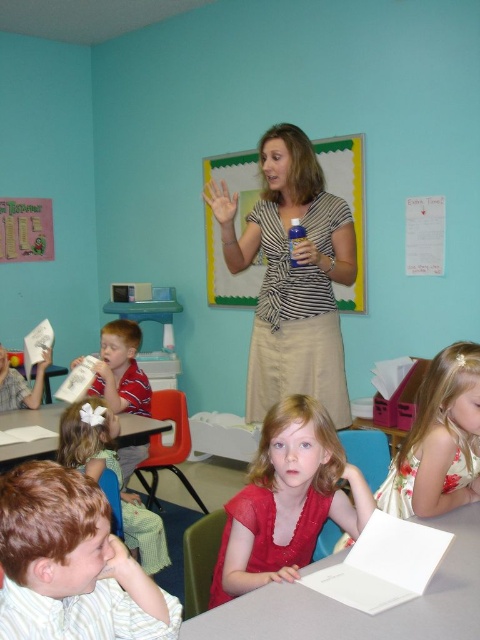
Question: Which object appears closest to the camera in this image?

Choices:
 (A) striped shirt at left
 (B) matte red dress at center

Answer: (B)

Question: Which object appears farthest from the camera in this image?

Choices:
 (A) striped fabric shirt at center
 (B) smooth skin hand at center
 (C) striped shirt at center
 (D) striped shirt at left

Answer: (D)

Question: Does striped shirt at center appear on the left side of striped shirt at left?

Choices:
 (A) yes
 (B) no

Answer: (B)

Question: Does striped fabric shirt at center appear under light brown hair at center?

Choices:
 (A) yes
 (B) no

Answer: (B)

Question: Is matte red dress at center positioned behind light brown hair at center?

Choices:
 (A) no
 (B) yes

Answer: (A)

Question: Among these objects, which one is farthest from the camera?

Choices:
 (A) striped shirt at center
 (B) striped fabric shirt at center
 (C) smooth skin hand at center

Answer: (B)